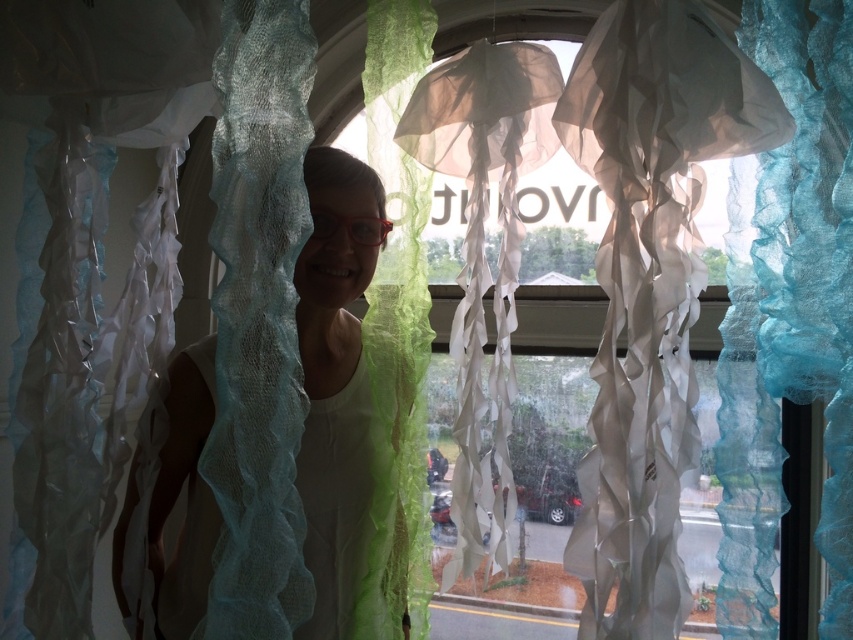
Question: Is white sheer fabric at center thinner than red translucent goggles at center?

Choices:
 (A) yes
 (B) no

Answer: (B)

Question: Observing the image, what is the correct spatial positioning of white sheer fabric at center in reference to red translucent goggles at center?

Choices:
 (A) below
 (B) above

Answer: (A)

Question: Can you confirm if white sheer fabric at center is thinner than red translucent goggles at center?

Choices:
 (A) yes
 (B) no

Answer: (B)